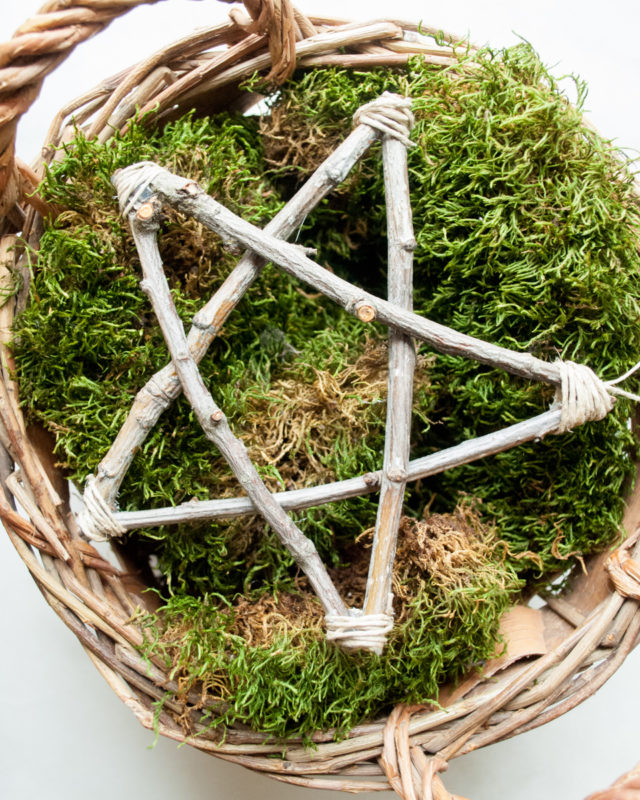
Identify the location of white bottom right of basket. (607, 738).